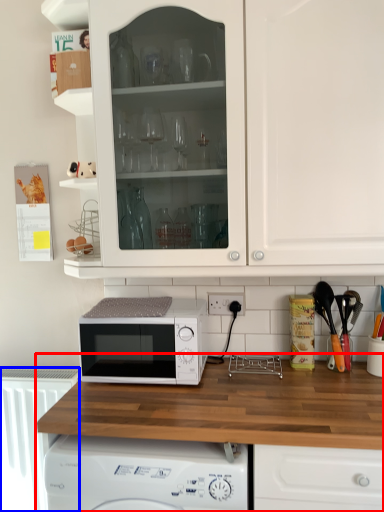
Question: Which object appears closest to the camera in this image, countertop (highlighted by a red box) or radiator (highlighted by a blue box)?

Choices:
 (A) countertop
 (B) radiator

Answer: (A)